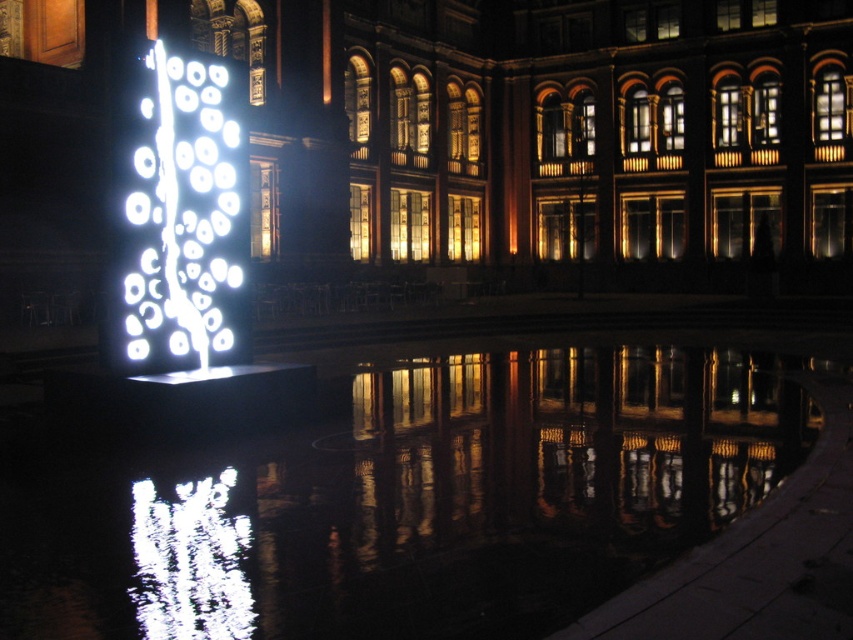
Question: Considering the relative positions of transparent liquid water at center and white glossy water at lower left in the image provided, where is transparent liquid water at center located with respect to white glossy water at lower left?

Choices:
 (A) above
 (B) below

Answer: (A)

Question: Which point is farther to the camera?

Choices:
 (A) white glossy water at lower left
 (B) white glossy neon light at left
 (C) transparent liquid water at center

Answer: (B)

Question: Is transparent liquid water at center closer to the viewer compared to white glossy neon light at left?

Choices:
 (A) yes
 (B) no

Answer: (A)

Question: Which point is farther to the camera?

Choices:
 (A) (126, 204)
 (B) (212, 595)

Answer: (A)

Question: Which of the following is the closest to the observer?

Choices:
 (A) (221, 316)
 (B) (219, 481)
 (C) (223, 532)

Answer: (C)

Question: In this image, where is transparent liquid water at center located relative to white glossy neon light at left?

Choices:
 (A) right
 (B) left

Answer: (A)